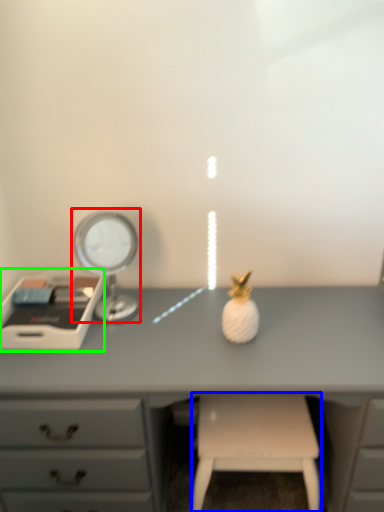
Question: Considering the real-world distances, which object is farthest from bedside lamp (highlighted by a red box)? stool (highlighted by a blue box) or writing desk (highlighted by a green box)?

Choices:
 (A) stool
 (B) writing desk

Answer: (A)